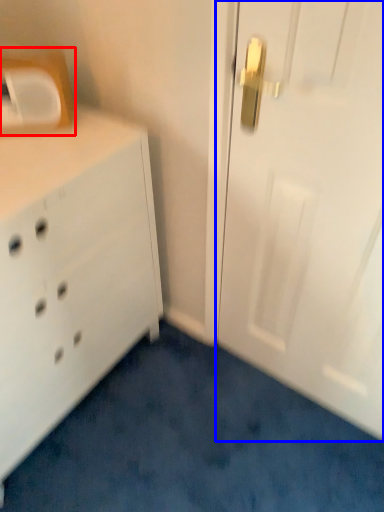
Question: Which object appears closest to the camera in this image, medicine cabinet (highlighted by a red box) or door (highlighted by a blue box)?

Choices:
 (A) medicine cabinet
 (B) door

Answer: (B)